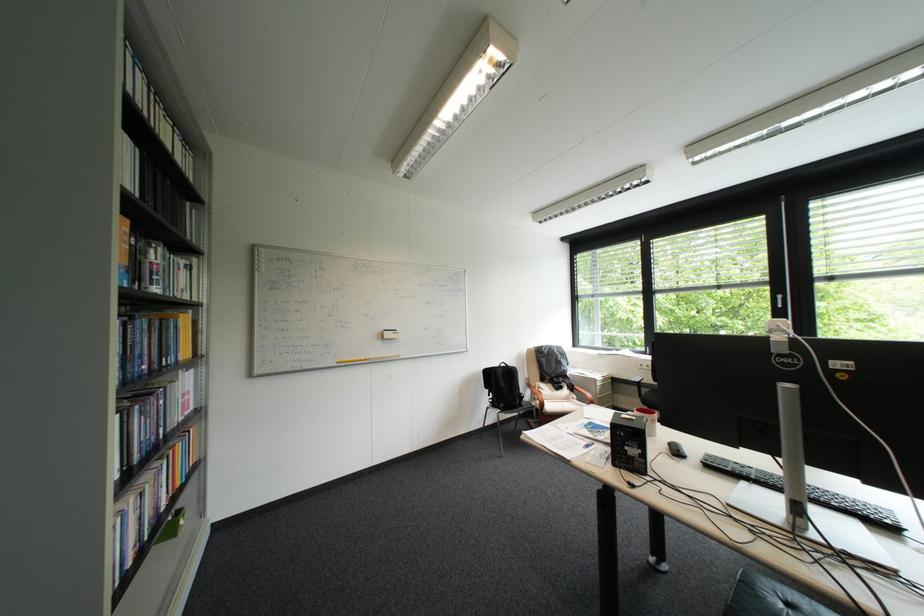
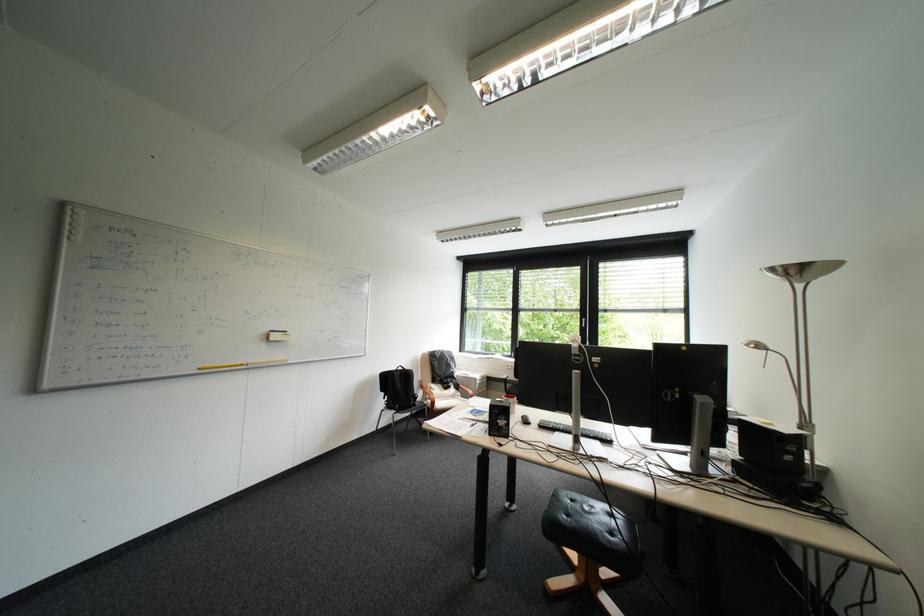
Question: Based on the continuous images, in which direction is the camera rotating? Reply with the corresponding letter.

Choices:
 (A) Left
 (B) Right
 (C) Up
 (D) Down

Answer: (B)